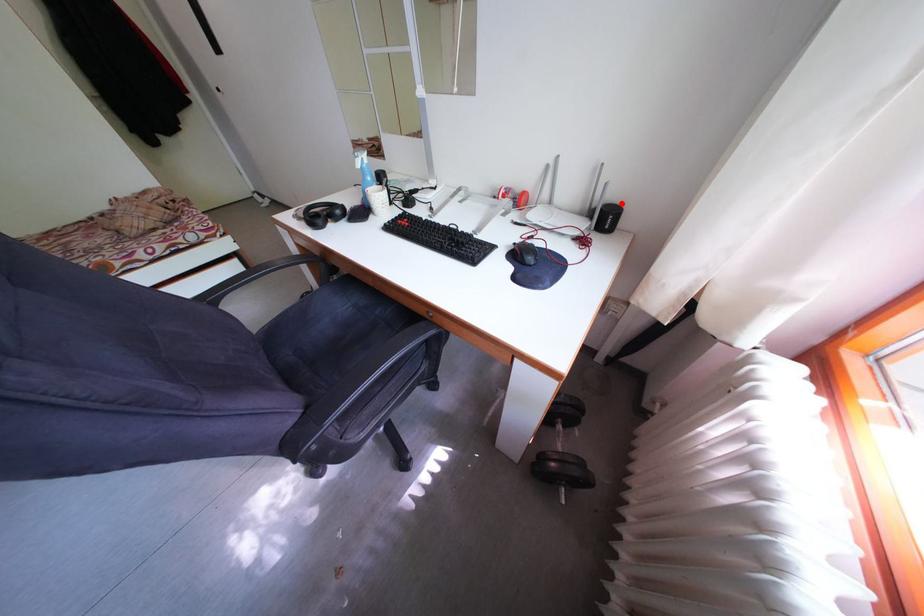
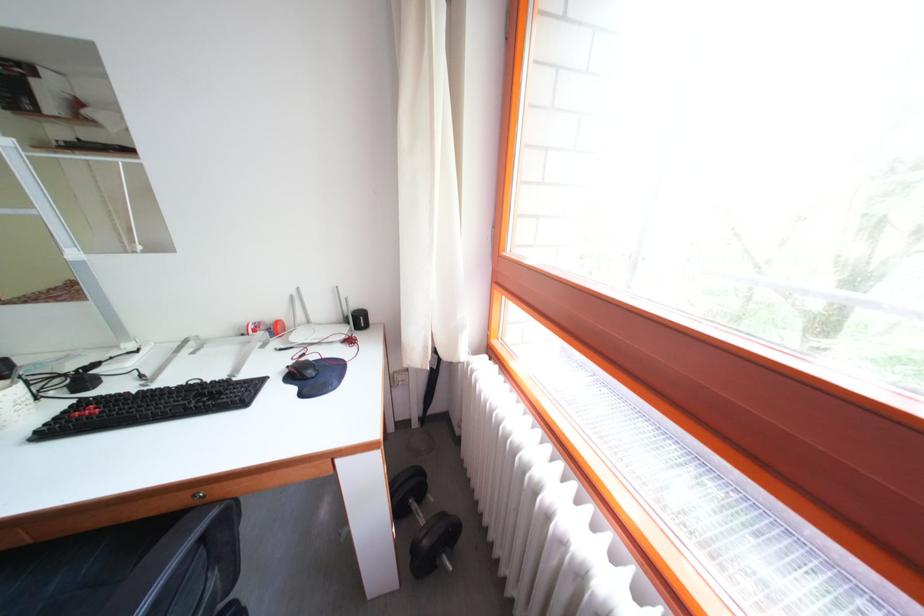
Locate, in the second image, the point that corresponds to the highlighted location in the first image.

(365, 312)